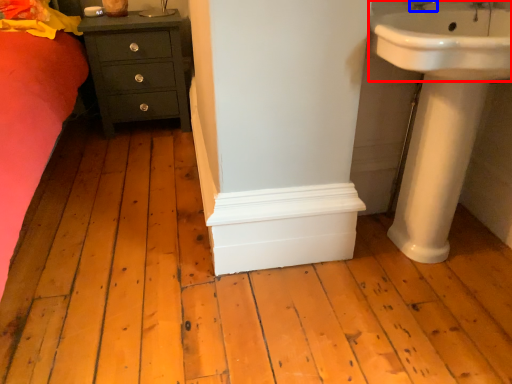
Question: Which object appears farthest to the camera in this image, sink (highlighted by a red box) or tap (highlighted by a blue box)?

Choices:
 (A) sink
 (B) tap

Answer: (B)